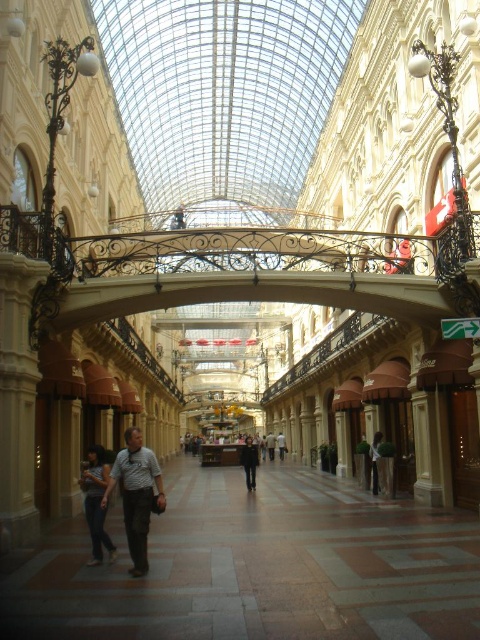
You are a customer in the shopping arcade and want to see the white cotton shirt at center. Is it visible from your current position in front of the black fabric jacket at center?

The white cotton shirt at center is behind the black fabric jacket at center, so it might not be fully visible from your current position in front of the black fabric jacket at center.